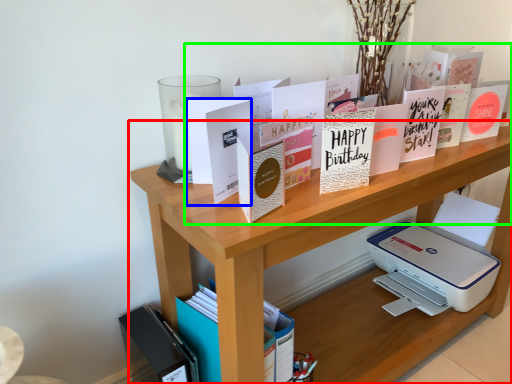
Question: Estimate the real-world distances between objects in this image. Which object is farther from shelf (highlighted by a red box), paperback book (highlighted by a blue box) or book (highlighted by a green box)?

Choices:
 (A) paperback book
 (B) book

Answer: (B)